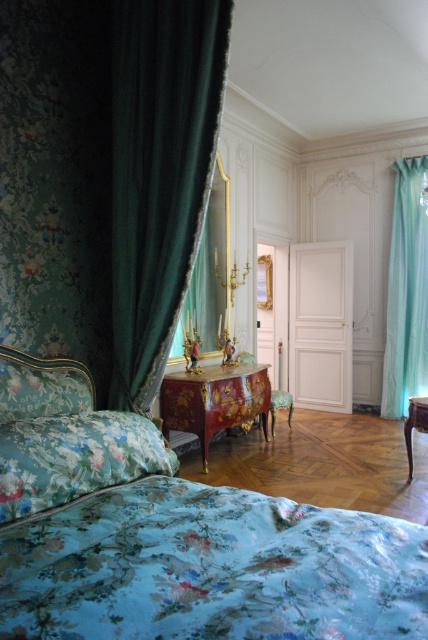
Question: Can you confirm if red lacquered dresser at center is thinner than wooden table at center?

Choices:
 (A) yes
 (B) no

Answer: (B)

Question: Estimate the real-world distances between objects in this image. Which object is farther from the gold lacquered armchair at center?

Choices:
 (A) light blue sheer curtain at right
 (B) wooden table at center
 (C) floral fabric bed at lower left
 (D) floral fabric pillow at lower left

Answer: (C)

Question: Among these objects, which one is farthest from the camera?

Choices:
 (A) floral fabric pillow at lower left
 (B) light blue sheer curtain at right
 (C) velvet dark green curtain at left

Answer: (B)

Question: Is floral fabric pillow at lower left to the right of light blue sheer curtain at right from the viewer's perspective?

Choices:
 (A) yes
 (B) no

Answer: (B)

Question: Can you confirm if floral fabric bed at lower left is positioned above red lacquered dresser at center?

Choices:
 (A) no
 (B) yes

Answer: (B)

Question: Which point is farther from the camera taking this photo?

Choices:
 (A) (184, 424)
 (B) (38, 429)

Answer: (A)